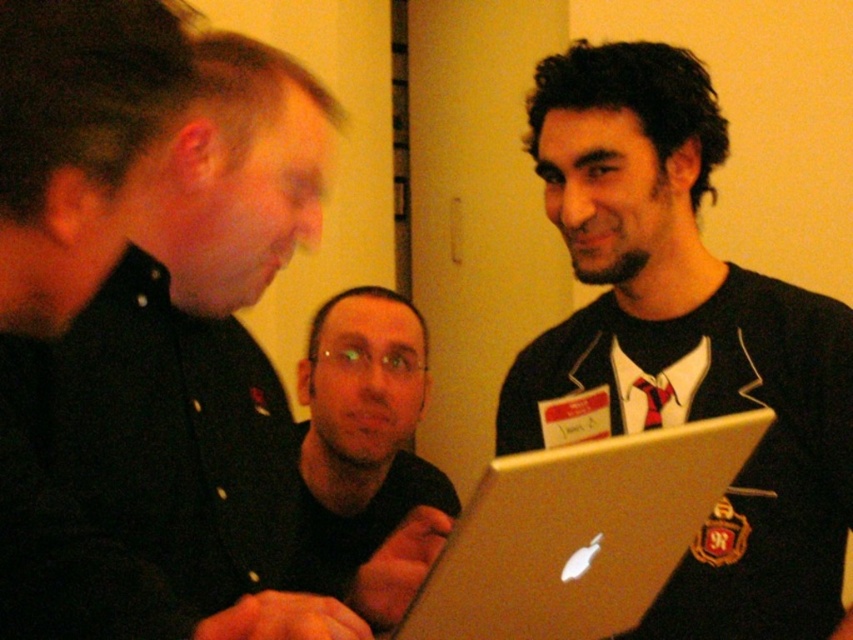
Question: Is silver metallic laptop at center bigger than matte black shirt at center?

Choices:
 (A) yes
 (B) no

Answer: (A)

Question: Is black matte shirt at left to the right of silver metallic laptop at center from the viewer's perspective?

Choices:
 (A) no
 (B) yes

Answer: (A)

Question: Observing the image, what is the correct spatial positioning of black matte shirt at left in reference to silver metallic laptop at center?

Choices:
 (A) above
 (B) below

Answer: (A)

Question: Which is farther from the silver metallic laptop at center?

Choices:
 (A) black matte shirt at left
 (B) matte black shirt at center

Answer: (B)

Question: Which point appears closest to the camera in this image?

Choices:
 (A) (231, 436)
 (B) (350, 397)

Answer: (A)

Question: Considering the real-world distances, which object is farthest from the matte black shirt at center?

Choices:
 (A) black matte shirt at left
 (B) silver metallic laptop at center

Answer: (B)